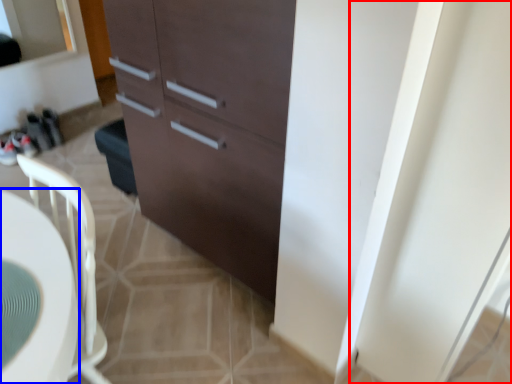
Question: Which point is closer to the camera, screen door (highlighted by a red box) or desk (highlighted by a blue box)?

Choices:
 (A) screen door
 (B) desk

Answer: (B)